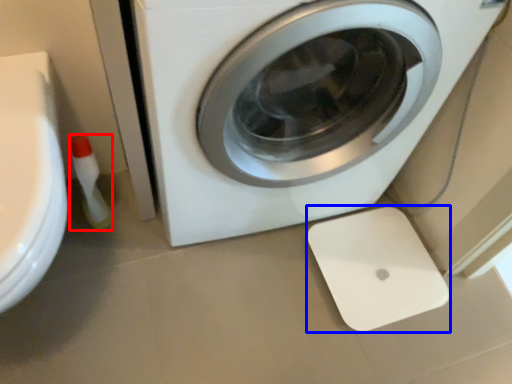
Question: Which object is further to the camera taking this photo, cleaning product (highlighted by a red box) or appliance (highlighted by a blue box)?

Choices:
 (A) cleaning product
 (B) appliance

Answer: (B)